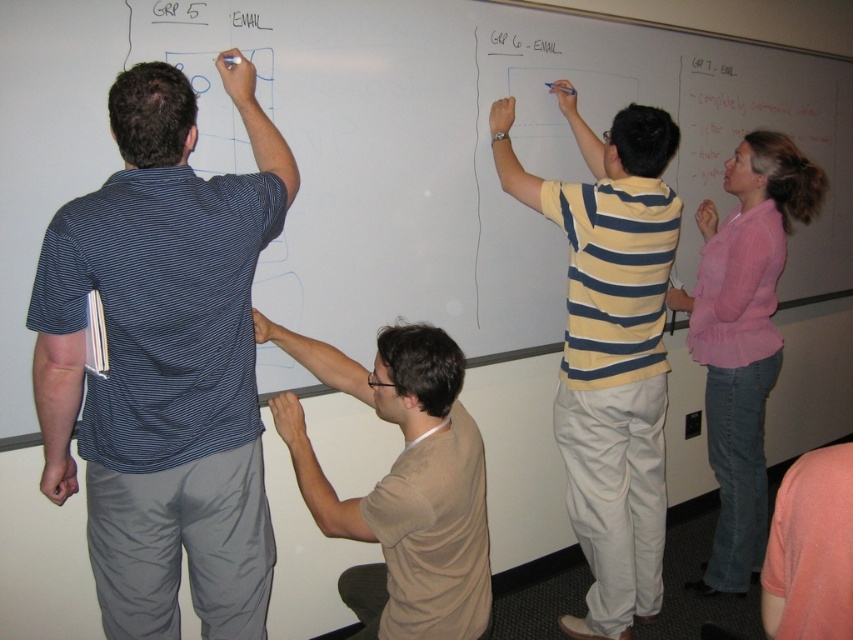
Who is positioned more to the left, yellow striped shirt at center or brown cotton shirt at lower center?

From the viewer's perspective, brown cotton shirt at lower center appears more on the left side.

Is yellow striped shirt at center to the right of brown cotton shirt at lower center from the viewer's perspective?

Yes, yellow striped shirt at center is to the right of brown cotton shirt at lower center.

Identify the location of yellow striped shirt at center. The width and height of the screenshot is (853, 640). (610, 348).

Is brown cotton shirt at lower center above pink linen blouse at upper right?

Actually, brown cotton shirt at lower center is below pink linen blouse at upper right.

This screenshot has height=640, width=853. Describe the element at coordinates (402, 484) in the screenshot. I see `brown cotton shirt at lower center` at that location.

Describe the element at coordinates (402, 484) in the screenshot. I see `brown cotton shirt at lower center` at that location.

The image size is (853, 640). What are the coordinates of `brown cotton shirt at lower center` in the screenshot? It's located at (402, 484).

Between yellow striped shirt at center and pink linen blouse at upper right, which one appears on the right side from the viewer's perspective?

pink linen blouse at upper right

Is yellow striped shirt at center wider than pink linen blouse at upper right?

No, yellow striped shirt at center is not wider than pink linen blouse at upper right.

Is point (573, 218) closer to viewer compared to point (730, 454)?

Yes, point (573, 218) is in front of point (730, 454).

Find the location of a particular element. yellow striped shirt at center is located at coordinates (610, 348).